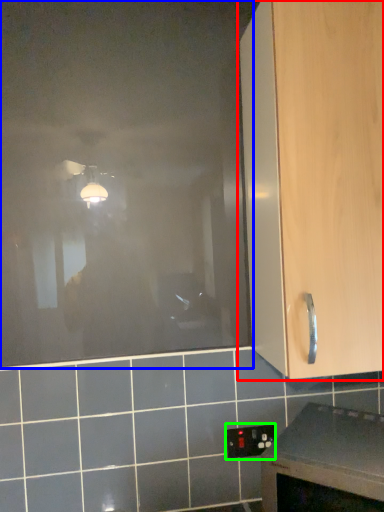
Question: Estimate the real-world distances between objects in this image. Which object is closer to cabinetry (highlighted by a red box), glass door (highlighted by a blue box) or electric outlet (highlighted by a green box)?

Choices:
 (A) glass door
 (B) electric outlet

Answer: (A)